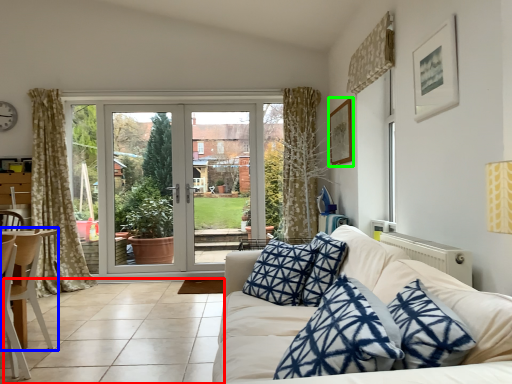
Question: Estimate the real-world distances between objects in this image. Which object is farther from tile (highlighted by a red box), chair (highlighted by a blue box) or picture frame (highlighted by a green box)?

Choices:
 (A) chair
 (B) picture frame

Answer: (B)